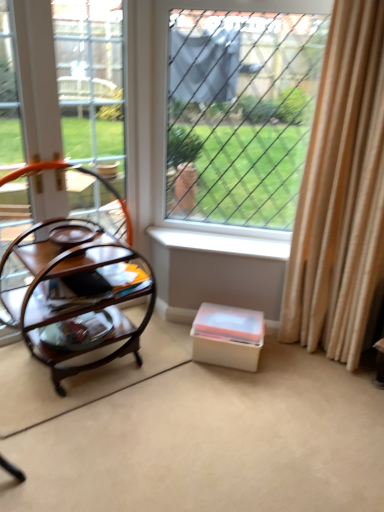
Question: Is wire mesh at center outside of wooden frame at left?

Choices:
 (A) no
 (B) yes

Answer: (B)

Question: From a real-world perspective, is wire mesh at center physically below wooden frame at left?

Choices:
 (A) no
 (B) yes

Answer: (A)

Question: From the image's perspective, would you say wire mesh at center is positioned over wooden frame at left?

Choices:
 (A) no
 (B) yes

Answer: (B)

Question: Considering the relative sizes of wire mesh at center and wooden frame at left in the image provided, is wire mesh at center shorter than wooden frame at left?

Choices:
 (A) no
 (B) yes

Answer: (B)

Question: Would you say wire mesh at center is a long distance from wooden frame at left?

Choices:
 (A) no
 (B) yes

Answer: (A)

Question: Does wire mesh at center come in front of wooden frame at left?

Choices:
 (A) yes
 (B) no

Answer: (B)

Question: Does white plastic window sill at center have a greater height compared to white plastic storage box at lower center?

Choices:
 (A) yes
 (B) no

Answer: (B)

Question: Is white plastic storage box at lower center inside white plastic window sill at center?

Choices:
 (A) no
 (B) yes

Answer: (A)

Question: Can you confirm if white plastic window sill at center is positioned to the right of white plastic storage box at lower center?

Choices:
 (A) no
 (B) yes

Answer: (A)

Question: Can you confirm if white plastic window sill at center is shorter than white plastic storage box at lower center?

Choices:
 (A) yes
 (B) no

Answer: (A)

Question: Is white plastic window sill at center wider than white plastic storage box at lower center?

Choices:
 (A) yes
 (B) no

Answer: (B)

Question: Considering the relative positions of white plastic window sill at center and white plastic storage box at lower center in the image provided, is white plastic window sill at center behind white plastic storage box at lower center?

Choices:
 (A) no
 (B) yes

Answer: (B)

Question: Can you confirm if woodenmaterial/texturetable at left is shorter than white plastic window sill at center?

Choices:
 (A) no
 (B) yes

Answer: (A)